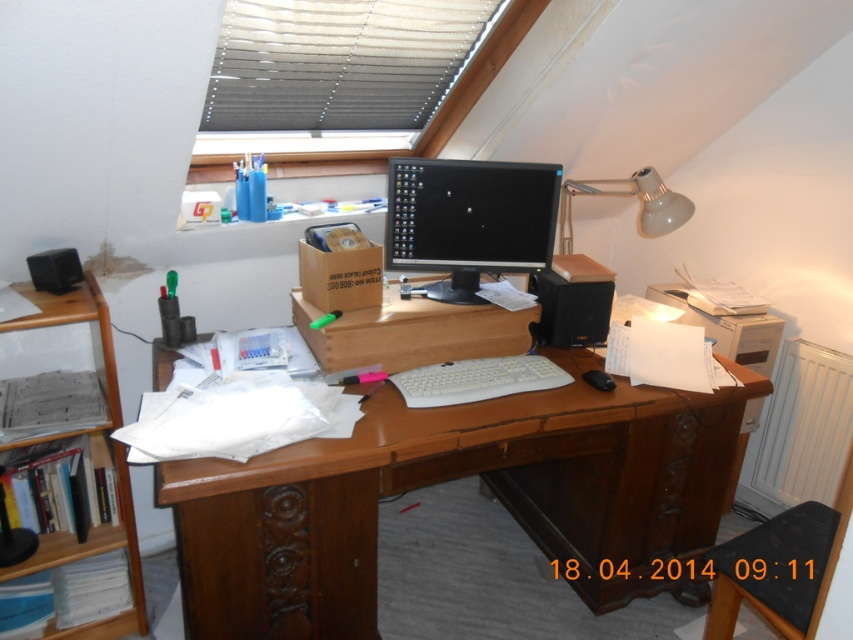
What do you see at coordinates (469, 220) in the screenshot?
I see `black glossy monitor at center` at bounding box center [469, 220].

Does black glossy monitor at center have a greater height compared to cardboard box at center?

Indeed, black glossy monitor at center has a greater height compared to cardboard box at center.

Between point (515, 186) and point (347, 308), which one is positioned in front?

Point (347, 308)

This screenshot has width=853, height=640. I want to click on black glossy monitor at center, so click(x=469, y=220).

Is white plastic keyboard at center above cardboard box at center?

No, white plastic keyboard at center is not above cardboard box at center.

In the scene shown: Who is more distant from viewer, (476, 378) or (344, 262)?

Positioned behind is point (476, 378).

The image size is (853, 640). Find the location of `white plastic keyboard at center`. white plastic keyboard at center is located at coordinates (477, 380).

Does brown wooden desk at center come behind white plastic lamp at upper right?

No, it is not.

Who is taller, brown wooden desk at center or white plastic lamp at upper right?

With more height is brown wooden desk at center.

Is point (422, 470) farther from camera compared to point (643, 227)?

No, it is in front of (643, 227).

Image resolution: width=853 pixels, height=640 pixels. What are the coordinates of `brown wooden desk at center` in the screenshot? It's located at (453, 477).